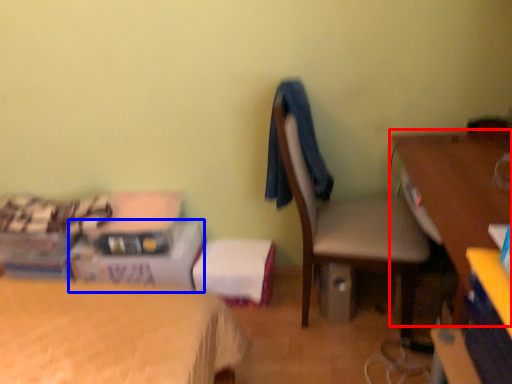
Question: Among these objects, which one is nearest to the camera, desk (highlighted by a red box) or box (highlighted by a blue box)?

Choices:
 (A) desk
 (B) box

Answer: (A)